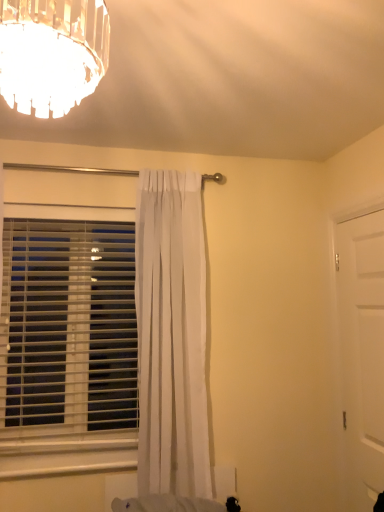
The width and height of the screenshot is (384, 512). What do you see at coordinates (362, 352) in the screenshot?
I see `white matte door at right` at bounding box center [362, 352].

Identify the location of white matte door at right. (362, 352).

This screenshot has width=384, height=512. Identify the location of white plastic blinds at left. (67, 329).

Is white sheer curtain at center positioned with its back to white matte door at right?

white sheer curtain at center is not turned away from white matte door at right.

In terms of width, does white sheer curtain at center look wider or thinner when compared to white matte door at right?

white sheer curtain at center is wider than white matte door at right.

Locate an element on the screen. curtain on the left of white matte door at right is located at coordinates (171, 335).

Considering their positions, is white sheer curtain at center located in front of or behind white matte door at right?

white sheer curtain at center is positioned farther from the viewer than white matte door at right.

Is white plastic blinds at left thinner than white matte door at right?

No, white plastic blinds at left is not thinner than white matte door at right.

Is white matte door at right a part of white plastic blinds at left?

No, white matte door at right is located outside of white plastic blinds at left.

Is white plastic blinds at left looking in the opposite direction of white matte door at right?

white plastic blinds at left is not turned away from white matte door at right.

Are white plastic blinds at left and white sheer curtain at center located far from each other?

No, white plastic blinds at left is not far away from white sheer curtain at center.

Considering the positions of objects white plastic blinds at left and white sheer curtain at center in the image provided, who is more to the right, white plastic blinds at left or white sheer curtain at center?

From the viewer's perspective, white sheer curtain at center appears more on the right side.

Which of these two, white plastic blinds at left or white sheer curtain at center, is bigger?

white sheer curtain at center.

Is white plastic blinds at left surrounding white sheer curtain at center?

Definitely not — white sheer curtain at center is not inside white plastic blinds at left.

Which is behind, point (168, 361) or point (87, 335)?

Point (87, 335)

Considering the relative sizes of white sheer curtain at center and white plastic blinds at left in the image provided, is white sheer curtain at center wider than white plastic blinds at left?

Yes.

From a real-world perspective, which object rests below the other?

From a 3D spatial view, white plastic blinds at left is below.

From the image's perspective, is white sheer curtain at center over white plastic blinds at left?

Yes, from the image's perspective, white sheer curtain at center is on top of white plastic blinds at left.

Considering the relative sizes of white matte door at right and white plastic blinds at left in the image provided, is white matte door at right bigger than white plastic blinds at left?

No, white matte door at right is not bigger than white plastic blinds at left.

Is there a large distance between white matte door at right and white plastic blinds at left?

white matte door at right is positioned a significant distance from white plastic blinds at left.

How different are the orientations of white matte door at right and white plastic blinds at left in degrees?

The angular difference between white matte door at right and white plastic blinds at left is 89 degrees.

In the image, there is a white matte door at right. Identify the location of curtain above it (from the image's perspective). (171, 335).

Which of these two, white matte door at right or white sheer curtain at center, is thinner?

white matte door at right.

Is white matte door at right turned away from white sheer curtain at center?

white matte door at right does not have its back to white sheer curtain at center.

In the scene shown: Can you confirm if white matte door at right is shorter than white sheer curtain at center?

Indeed, white matte door at right has a lesser height compared to white sheer curtain at center.

At what (x,y) coordinates should I click in order to perform the action: click on door located on the right of white sheer curtain at center. Please return your answer as a coordinate pair (x, y). The image size is (384, 512). Looking at the image, I should click on (362, 352).

This screenshot has height=512, width=384. I want to click on door beneath the white plastic blinds at left (from a real-world perspective), so click(362, 352).

Estimate the real-world distances between objects in this image. Which object is closer to white plastic blinds at left, white matte door at right or white sheer curtain at center?

white sheer curtain at center is closer to white plastic blinds at left.

Estimate the real-world distances between objects in this image. Which object is closer to white plastic blinds at left, white sheer curtain at center or white matte door at right?

Based on the image, white sheer curtain at center appears to be nearer to white plastic blinds at left.

Considering their positions, is white plastic blinds at left positioned further to white sheer curtain at center than white matte door at right?

white matte door at right.

Looking at the image, which one is located further to white matte door at right, white plastic blinds at left or white sheer curtain at center?

Based on the image, white plastic blinds at left appears to be further to white matte door at right.

Considering their positions, is white sheer curtain at center positioned further to white matte door at right than white plastic blinds at left?

white plastic blinds at left.

Which object lies nearer to the anchor point white sheer curtain at center, white matte door at right or white plastic blinds at left?

white plastic blinds at left is closer to white sheer curtain at center.

The width and height of the screenshot is (384, 512). Identify the location of curtain situated between white plastic blinds at left and white matte door at right from left to right. (171, 335).